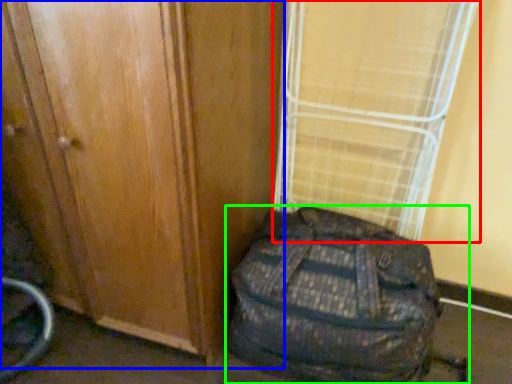
Question: Which object is positioned closest to curtain (highlighted by a red box)? Select from door (highlighted by a blue box) and backpack (highlighted by a green box).

Choices:
 (A) door
 (B) backpack

Answer: (B)